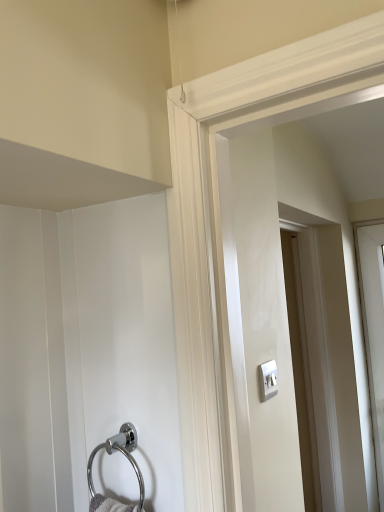
Measure the distance between point (x=117, y=439) and camera.

A distance of 34.96 inches exists between point (x=117, y=439) and camera.

Image resolution: width=384 pixels, height=512 pixels. I want to click on satin chrome towel ring at lower left, so click(x=128, y=460).

The width and height of the screenshot is (384, 512). Describe the element at coordinates (128, 460) in the screenshot. I see `satin chrome towel ring at lower left` at that location.

Image resolution: width=384 pixels, height=512 pixels. I want to click on satin chrome towel ring at lower left, so click(128, 460).